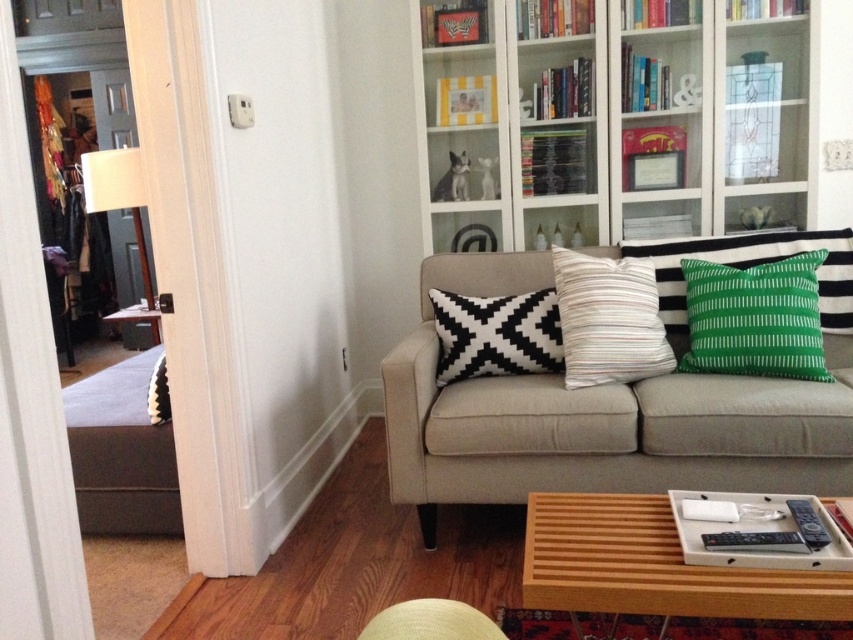
You are sitting on the beige sofa and want to pick up the white striped pillow at center. Which direction should you reach to grab it?

The white striped pillow at center is located at point 0.500 on the x axis and 0.714 on the y axis, so you should reach forward and to the right to grab it.

You are standing in the living room and see two points in the scene. The first point is at coordinates point (677, 113) and the second is at point (532, 362). Which point is closer to you?

Point (677, 113) is further to the camera than point (532, 362), so the second point is closer to you.